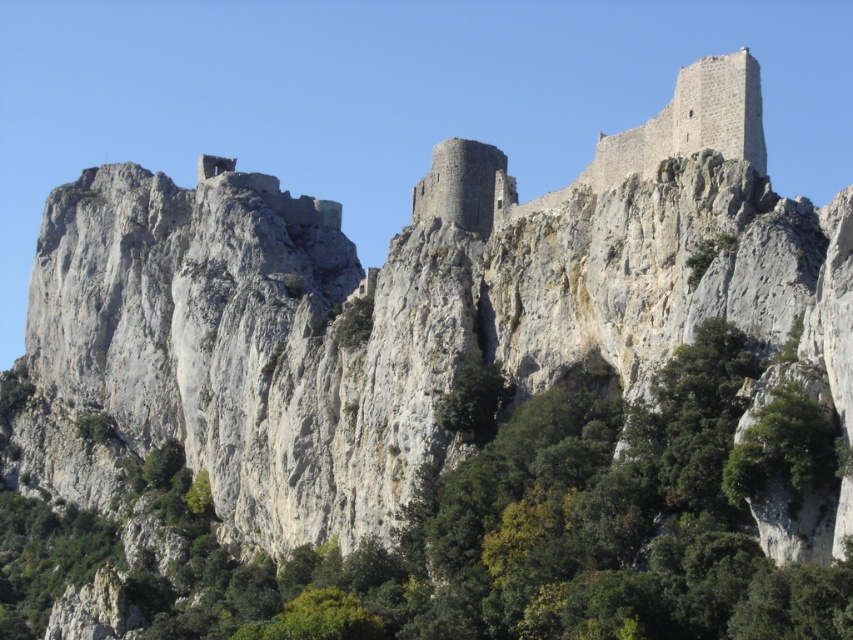
Based on the photo, you are standing in the rugged landscape and want to take a photo of both the green leafy tree at center and the gray stone castle at upper right. Which object should you focus on first to ensure both are in sharp focus?

You should focus on the green leafy tree at center first because it is closer to the viewer than the gray stone castle at upper right. By focusing on the closer object, the castle will still be in focus due to the depth of field, ensuring both are sharp.

You are an architect evaluating the stability of the gray stone castle at upper right and the green leafy tree at center. Considering their sizes, which one might be more vulnerable to strong winds?

The gray stone castle at upper right is more vulnerable to strong winds because it is smaller than the green leafy tree at center, making it less stable against wind forces.

From the picture: You are an architect evaluating the feasibility of building a new observation deck. You need to determine if the green leafy tree at center and the gray stone castle at upper right can both be incorporated into the design. Considering their heights, which one would require more vertical space in the plan?

The green leafy tree at center is taller than the gray stone castle at upper right, so it would require more vertical space in the plan.